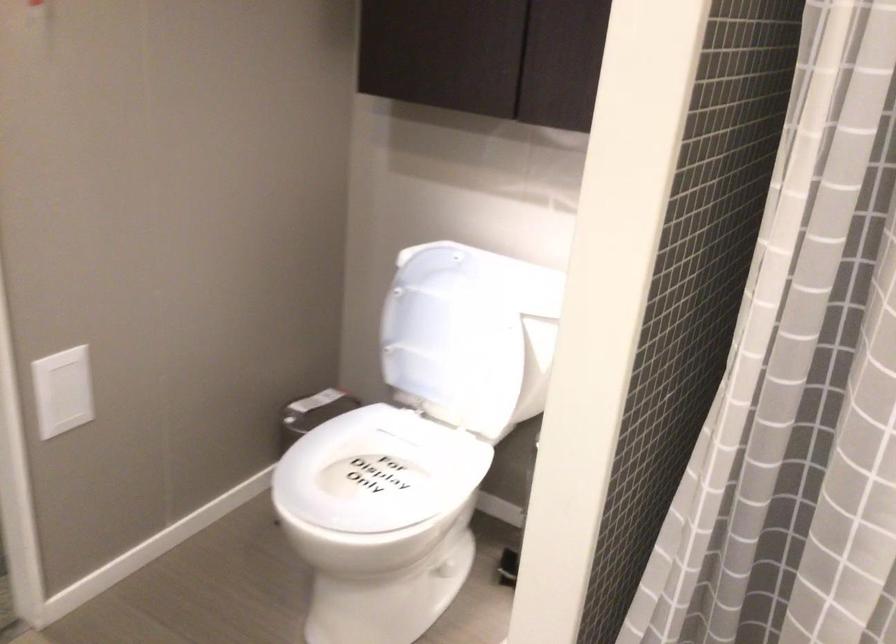
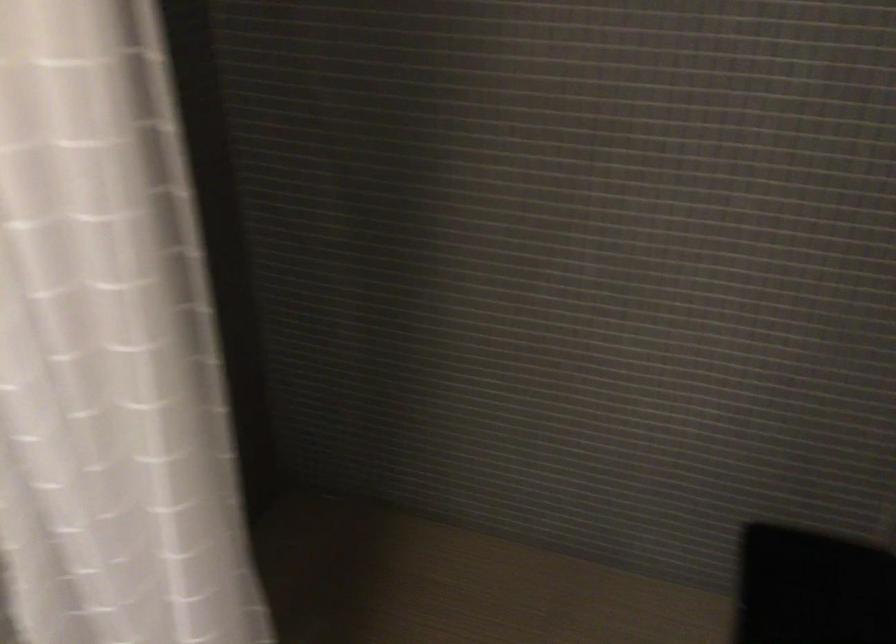
Question: What movement of the cameraman would produce the second image?

Choices:
 (A) Left
 (B) Right
 (C) Forward
 (D) Backward

Answer: (B)